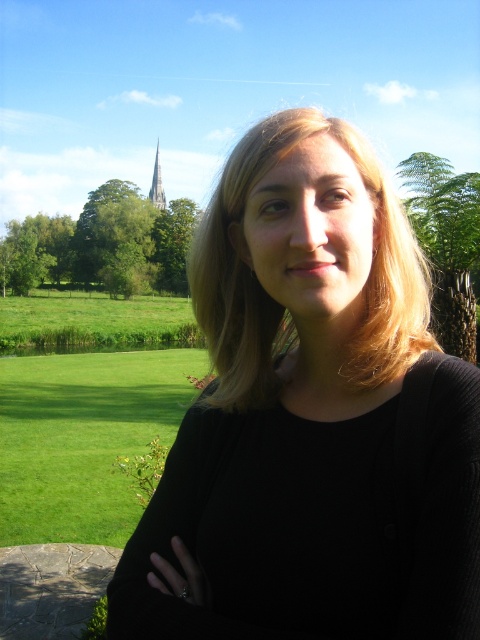
Question: Is green leafy tree at upper left behind green leafy tree at right?

Choices:
 (A) yes
 (B) no

Answer: (A)

Question: Among these objects, which one is nearest to the camera?

Choices:
 (A) green leafy tree at upper left
 (B) blonde smooth hair at center
 (C) green leafy tree at upper center

Answer: (B)

Question: Does black matte shirt at center come in front of green leafy tree at upper left?

Choices:
 (A) yes
 (B) no

Answer: (A)

Question: Does black matte shirt at center lie behind blonde smooth hair at center?

Choices:
 (A) yes
 (B) no

Answer: (B)

Question: Which point appears farthest from the camera in this image?

Choices:
 (A) (343, 230)
 (B) (202, 420)

Answer: (B)

Question: Which point is closer to the camera taking this photo?

Choices:
 (A) (439, 188)
 (B) (162, 632)
 (C) (375, 628)

Answer: (C)